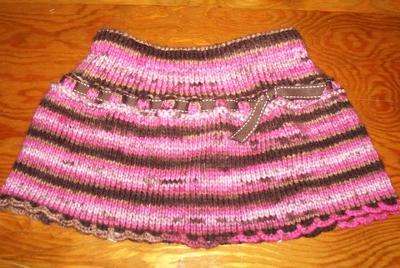
Where is `table`? The height and width of the screenshot is (268, 400). table is located at coordinates (378, 91).